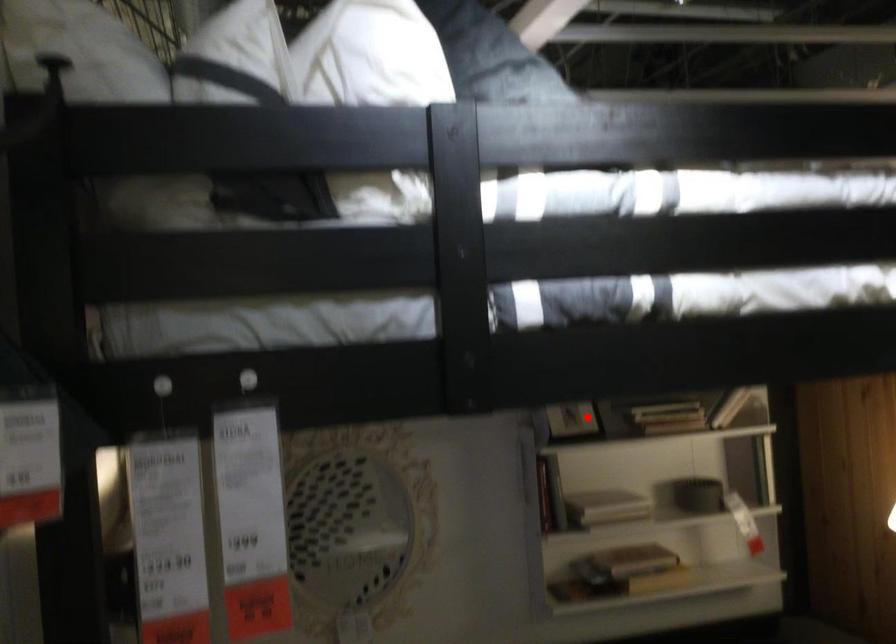
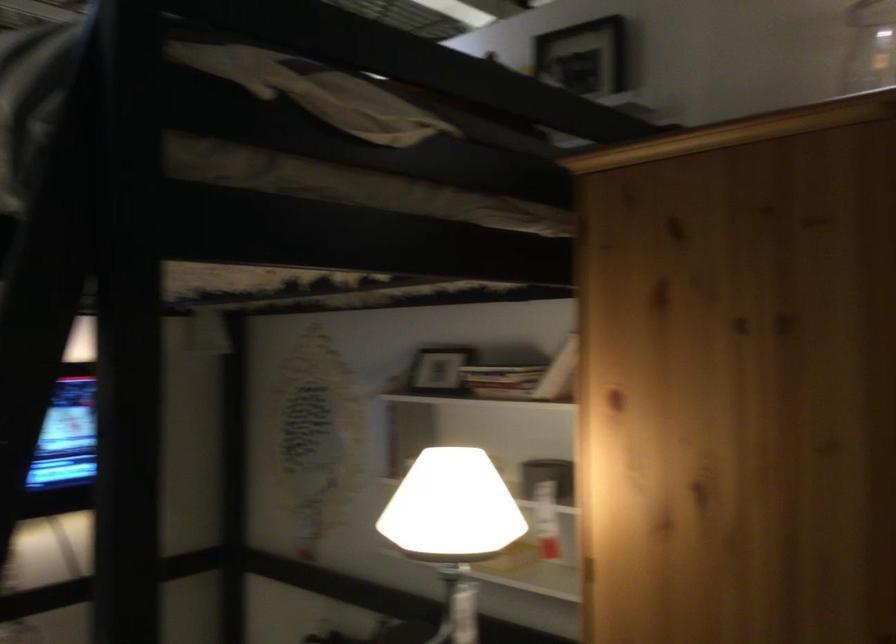
Locate, in the second image, the point that corresponds to the highlighted location in the first image.

(435, 372)